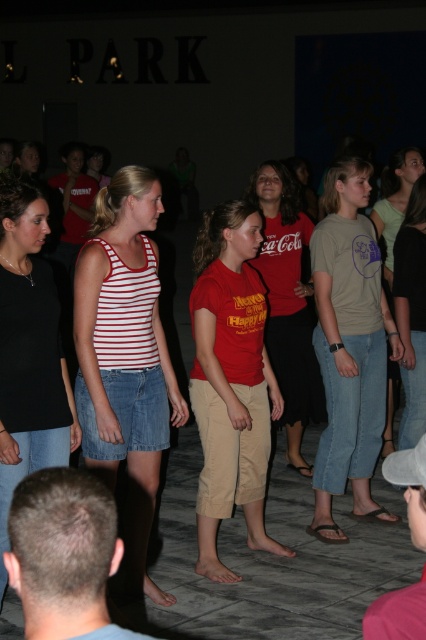
You are organizing a clothing donation drive and need to decide which of the two shirts, the striped cotton tank top at center or the light brown cotton shirt at center, can fit into a narrow donation box. Which one would you choose?

The striped cotton tank top at center is thinner than the light brown cotton shirt at center, so it can fit into the narrow donation box.

What is the exact location of the black matte tank top at center in the image?

The black matte tank top at center is located at point coordinates of (28, 352).